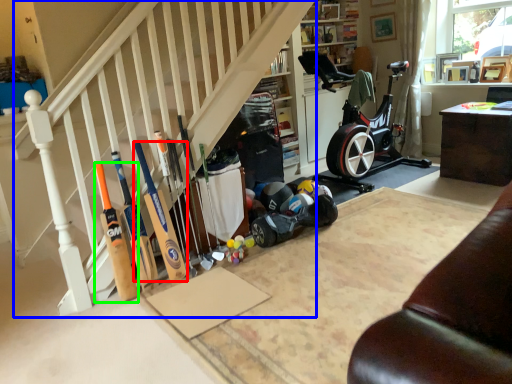
Question: Which object is the farthest from baseball bat (highlighted by a red box)? Choose among these: stairwell (highlighted by a blue box) or baseball bat (highlighted by a green box).

Choices:
 (A) stairwell
 (B) baseball bat

Answer: (A)